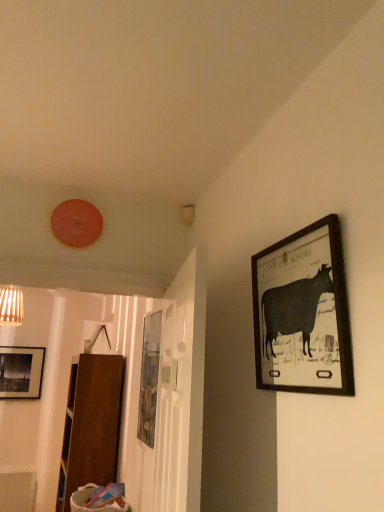
Question: From the image's perspective, relative to matte black picture frame at upper right, marked as the second picture frame in a back-to-front arrangement, is matte wooden picture frame at center, the first picture frame positioned from the back, above or below?

Choices:
 (A) below
 (B) above

Answer: (A)

Question: Considering the positions of matte wooden picture frame at center, which is the 2th picture frame from right to left, and matte black picture frame at upper right, marked as the second picture frame in a back-to-front arrangement, in the image, is matte wooden picture frame at center, which is the 2th picture frame from right to left, bigger or smaller than matte black picture frame at upper right, marked as the second picture frame in a back-to-front arrangement,?

Choices:
 (A) big
 (B) small

Answer: (A)

Question: Is point (139, 434) closer or farther from the camera than point (301, 271)?

Choices:
 (A) farther
 (B) closer

Answer: (A)

Question: Is matte black picture frame at upper right, arranged as the 2th picture frame when ordered from the bottom, wider or thinner than matte wooden picture frame at center, the first picture frame in the left-to-right sequence?

Choices:
 (A) thin
 (B) wide

Answer: (A)

Question: Is matte black picture frame at upper right, arranged as the 2th picture frame when ordered from the bottom, inside the boundaries of matte wooden picture frame at center, the 2th picture frame from the top, or outside?

Choices:
 (A) outside
 (B) inside

Answer: (A)

Question: Is point (304, 315) positioned closer to the camera than point (152, 364)?

Choices:
 (A) closer
 (B) farther

Answer: (A)

Question: From the image's perspective, relative to matte wooden picture frame at center, the first picture frame in the left-to-right sequence, is matte black picture frame at upper right, marked as the second picture frame in a back-to-front arrangement, above or below?

Choices:
 (A) above
 (B) below

Answer: (A)